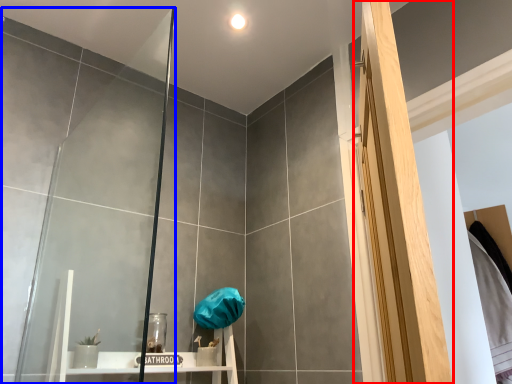
Question: Among these objects, which one is farthest to the camera, screen door (highlighted by a red box) or glass door (highlighted by a blue box)?

Choices:
 (A) screen door
 (B) glass door

Answer: (B)